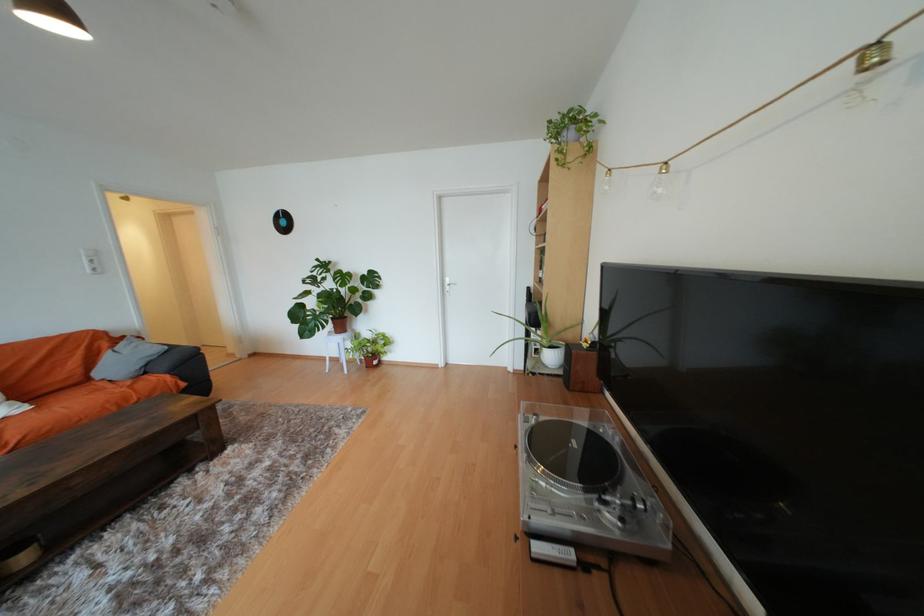
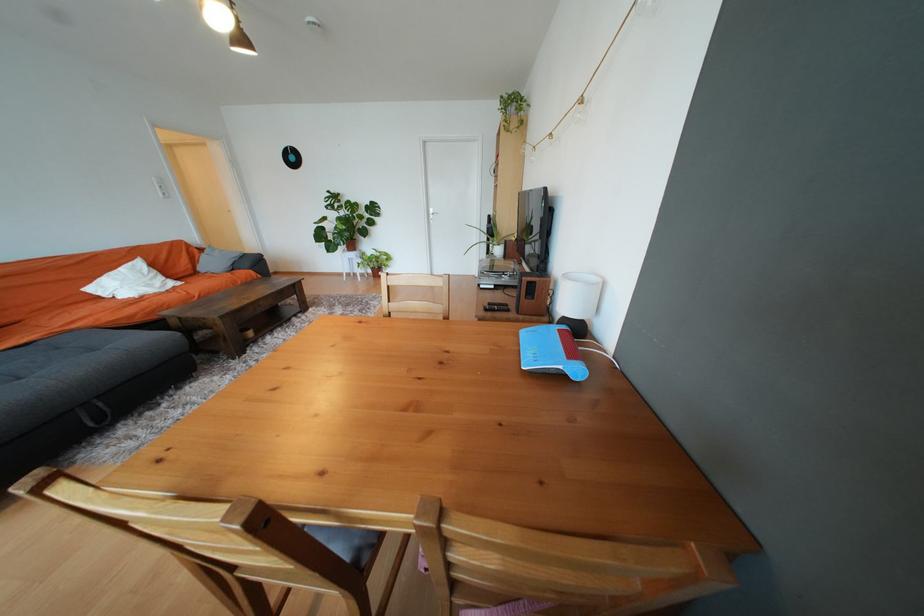
Locate, in the second image, the point that corresponds to (454,281) in the first image.

(438, 211)